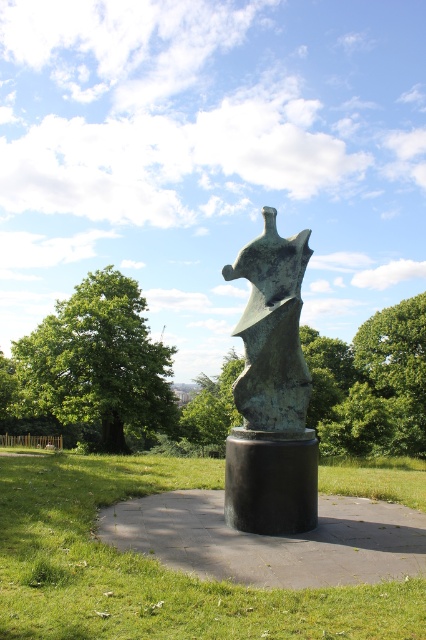
Question: Is green grass at center to the right of green leafy tree at left from the viewer's perspective?

Choices:
 (A) no
 (B) yes

Answer: (B)

Question: Estimate the real-world distances between objects in this image. Which object is farther from the green grass at center?

Choices:
 (A) green leafy tree at left
 (B) green leafy tree at center
 (C) green patina sculpture at center

Answer: (A)

Question: Does green leafy tree at left have a lesser width compared to green patina sculpture at center?

Choices:
 (A) yes
 (B) no

Answer: (B)

Question: Which of the following is the farthest from the observer?

Choices:
 (A) green grass at center
 (B) green patina sculpture at center
 (C) green leafy tree at center
 (D) green leafy tree at left

Answer: (D)

Question: Considering the real-world distances, which object is closest to the green patina sculpture at center?

Choices:
 (A) green grass at center
 (B) green leafy tree at center

Answer: (A)

Question: Is green leafy tree at left closer to the viewer compared to green patina sculpture at center?

Choices:
 (A) no
 (B) yes

Answer: (A)